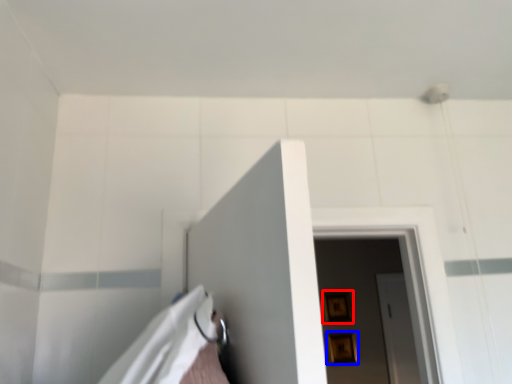
Question: Which point is closer to the camera, picture frame (highlighted by a red box) or picture frame (highlighted by a blue box)?

Choices:
 (A) picture frame
 (B) picture frame

Answer: (B)